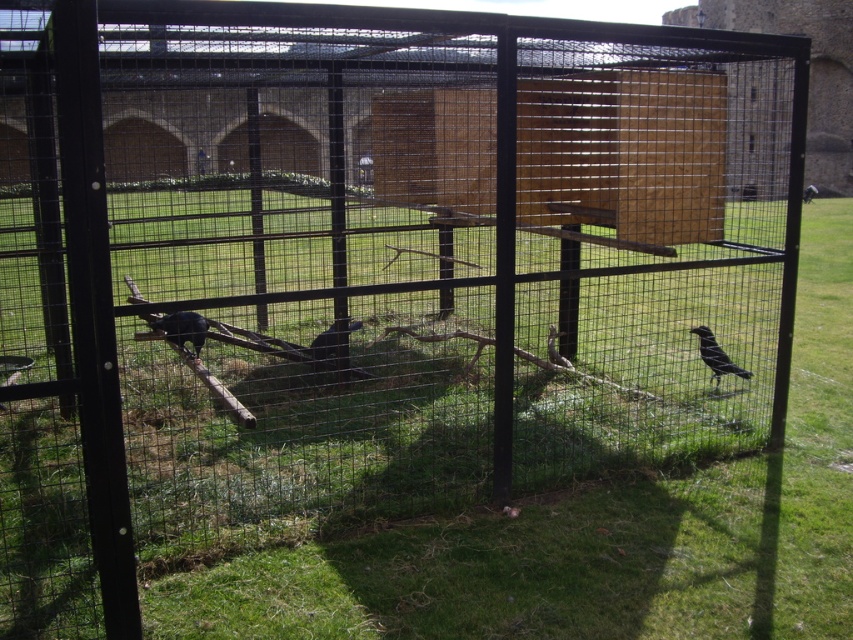
Which is behind, point (207, 320) or point (317, 355)?

The point (207, 320) is more distant.

The width and height of the screenshot is (853, 640). I want to click on shiny black bird at center, so click(183, 328).

Measure the distance from black matte bird at right to matte black bird at center.

2.21 meters

Is point (706, 355) less distant than point (322, 332)?

Yes.

Between point (709, 339) and point (335, 330), which one is positioned in front?

Point (709, 339) is in front.

Identify the location of black matte bird at right. (717, 355).

Who is more forward, (170,324) or (733,369)?

Positioned in front is point (733,369).

Measure the distance between shiny black bird at center and camera.

shiny black bird at center and camera are 5.66 meters apart.

What do you see at coordinates (183, 328) in the screenshot? This screenshot has width=853, height=640. I see `shiny black bird at center` at bounding box center [183, 328].

The image size is (853, 640). I want to click on shiny black bird at center, so click(183, 328).